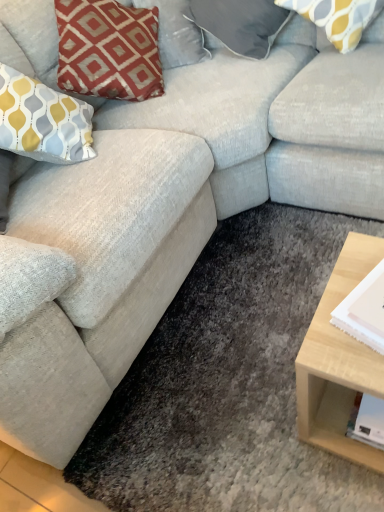
Question: Is white paper at right wider or thinner than satin gray pillow at upper center, arranged as the 1th pillow when viewed from the left?

Choices:
 (A) thin
 (B) wide

Answer: (A)

Question: From their relative heights in the image, would you say white paper at right is taller or shorter than satin gray pillow at upper center, which appears as the 2th pillow when viewed from the right?

Choices:
 (A) short
 (B) tall

Answer: (A)

Question: Which of these objects is positioned farthest from the white paper at right?

Choices:
 (A) satin gray pillow at upper center, which appears as the 2th pillow when viewed from the right
 (B) yellow and gray patterned pillow at upper right, positioned as the 2th pillow in left-to-right order

Answer: (A)

Question: Which is farther from the white paper at right?

Choices:
 (A) satin gray pillow at upper center, arranged as the 1th pillow when viewed from the left
 (B) yellow and gray patterned pillow at upper right, positioned as the 2th pillow in left-to-right order

Answer: (A)